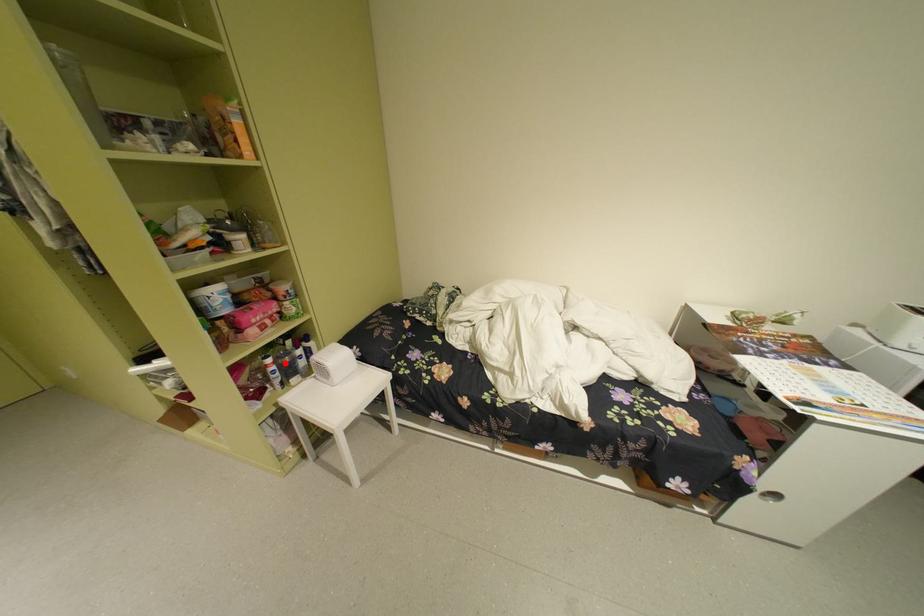
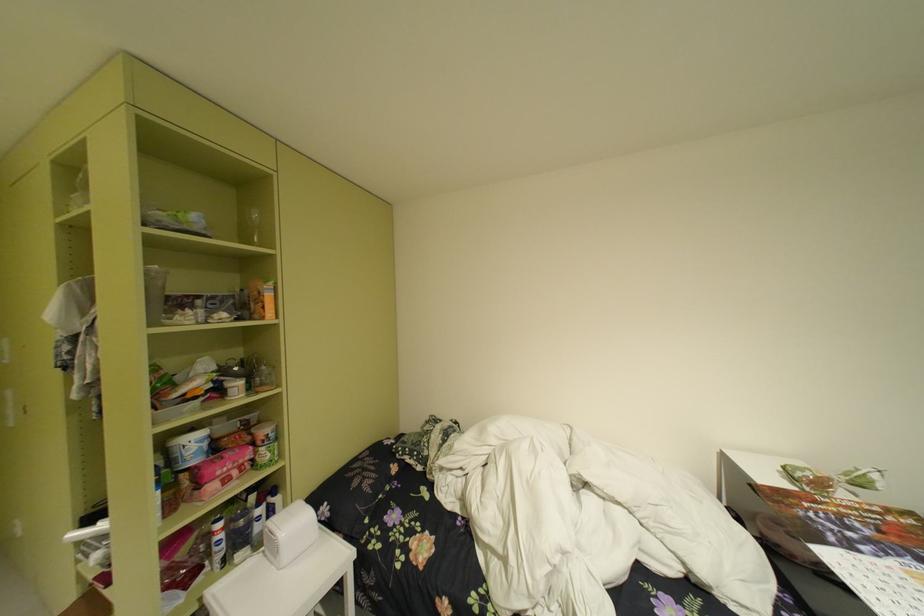
Find the pixel in the second image that matches the highlighted location in the first image.

(235, 528)